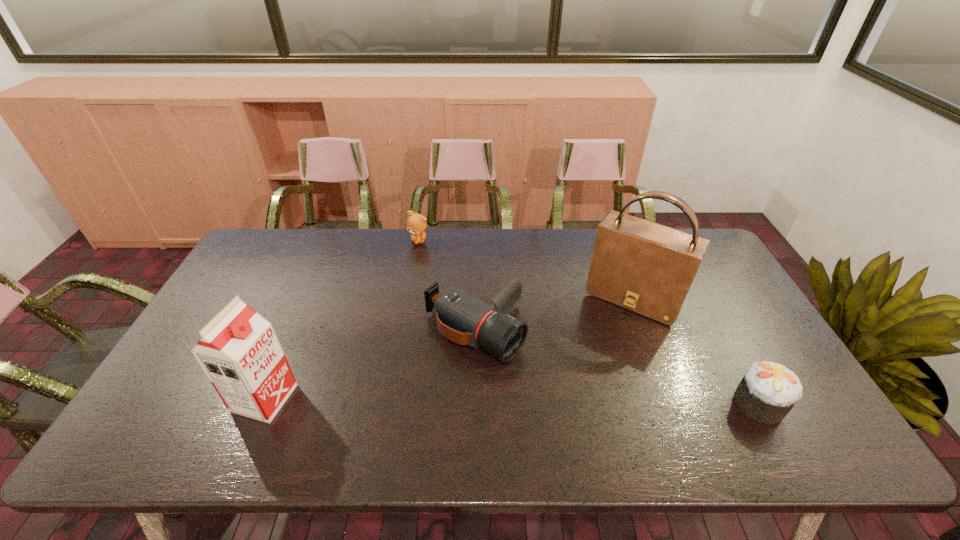
I want to click on free space located on the face of the fourth object from right to left, so click(x=440, y=308).

Locate an element on the screen. vacant region located on the face of the fourth object from right to left is located at coordinates (430, 276).

Locate an element on the screen. The image size is (960, 540). free spot located on the face of the fourth object from right to left is located at coordinates (435, 293).

The width and height of the screenshot is (960, 540). I want to click on vacant point located on the lens of the camcorder, so click(557, 383).

Find the location of a particular element. The image size is (960, 540). vacant point located 0.280m on the lens of the camcorder is located at coordinates (611, 415).

Identify the location of blank area located on the lens of the camcorder. (585, 400).

At what (x,y) coordinates should I click in order to perform the action: click on vacant region located on the front flap of the tallest object. Please return your answer as a coordinate pair (x, y). Looking at the image, I should click on (596, 356).

I want to click on free space located on the front flap of the tallest object, so click(x=608, y=335).

Locate an element on the screen. vacant region located 0.250m on the front flap of the tallest object is located at coordinates (581, 382).

Image resolution: width=960 pixels, height=540 pixels. Find the location of `teddy bear located at the far edge`. teddy bear located at the far edge is located at coordinates (416, 224).